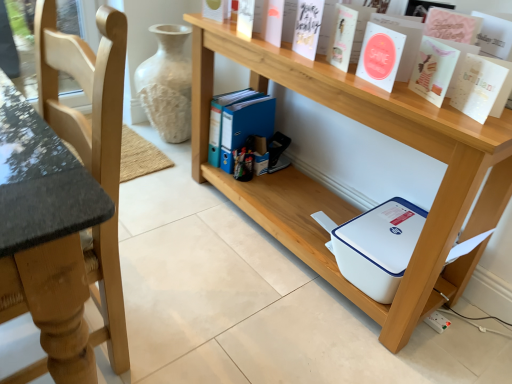
Question: In the image, is white paper at upper right, acting as the fifth paperback book starting from the left, positioned in front of or behind light wood chair at left?

Choices:
 (A) front
 (B) behind

Answer: (B)

Question: Is white paper at upper right, which ranks as the first paperback book in right-to-left order, inside or outside of light wood chair at left?

Choices:
 (A) inside
 (B) outside

Answer: (B)

Question: Which object is positioned closest to the white paper at upper right, acting as the fifth paperback book starting from the left?

Choices:
 (A) light wood chair at left
 (B) white matte paper at upper center, which ranks as the fifth paperback book in right-to-left order
 (C) white paper at upper center, the 3th paperback book positioned from the right
 (D) white plastic printer at lower center
 (E) white matte vase at center

Answer: (C)

Question: Estimate the real-world distances between objects in this image. Which object is closer to the light wood chair at left?

Choices:
 (A) matte pink card at upper right, which is counted as the 4th paperback book, starting from the left
 (B) white paper at upper center, the 3th paperback book positioned from the right
 (C) white matte vase at center
 (D) white matte paper at upper center, which is counted as the first paperback book, starting from the left
 (E) white matte paper at upper center, the fourth paperback book viewed from the right

Answer: (B)